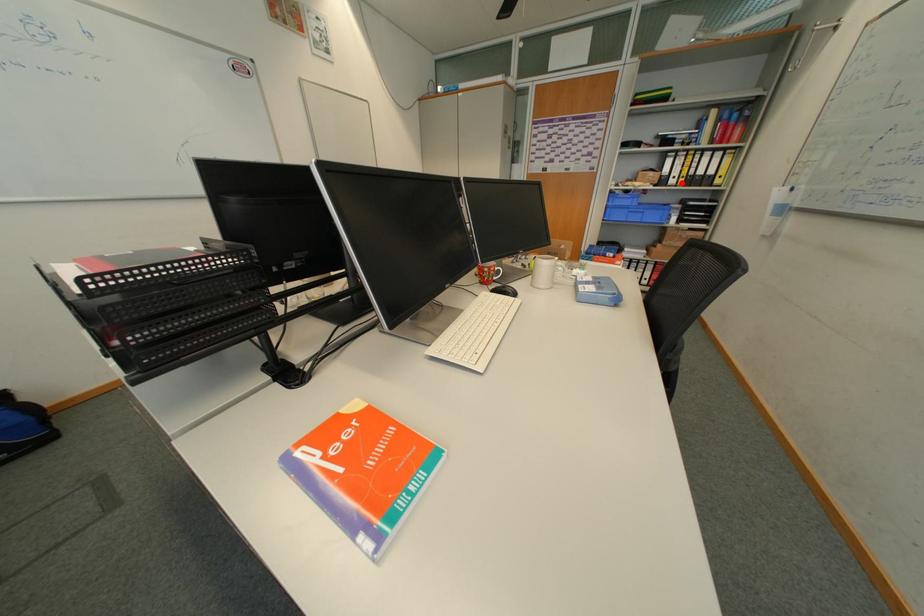
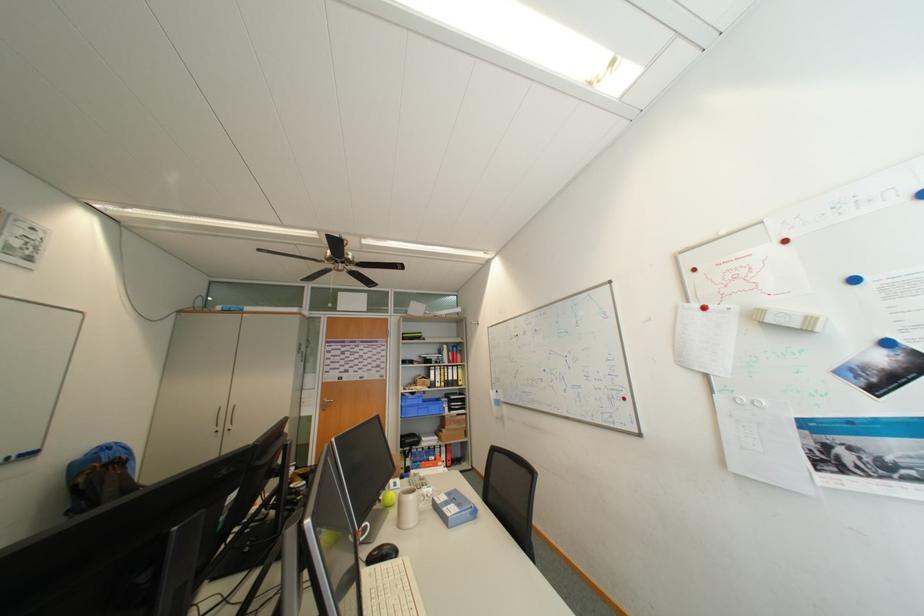
Question: I am providing you with two images of the same scene from different viewpoints. In image1, a red point is highlighted. Considering the same 3D point in image2, which of the following is correct?

Choices:
 (A) It is closer
 (B) It is farther

Answer: (B)